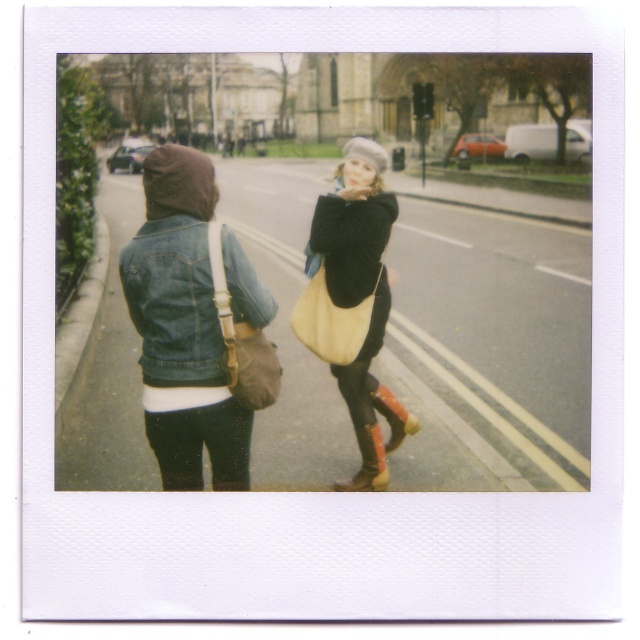
Question: Is brown leather bag at left to the left of leather tan bag at center from the viewer's perspective?

Choices:
 (A) yes
 (B) no

Answer: (A)

Question: Among these points, which one is nearest to the camera?

Choices:
 (A) pyautogui.click(x=243, y=410)
 (B) pyautogui.click(x=342, y=323)
 (C) pyautogui.click(x=384, y=484)

Answer: (A)

Question: Can you confirm if leather tan bag at center is thinner than leather boot at lower center?

Choices:
 (A) yes
 (B) no

Answer: (B)

Question: Estimate the real-world distances between objects in this image. Which object is farther from the leather boot at lower center?

Choices:
 (A) leather tan bag at center
 (B) matte yellow bag at center
 (C) brown leather bag at left

Answer: (C)

Question: Which point is farther to the camera?

Choices:
 (A) (170, 472)
 (B) (337, 483)

Answer: (B)

Question: Is leather tan bag at center wider than brown leather boot at lower center?

Choices:
 (A) no
 (B) yes

Answer: (B)